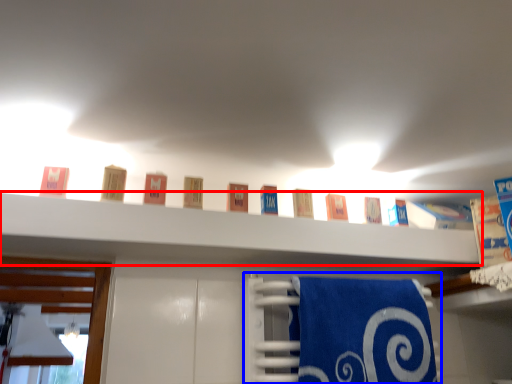
Question: Which point is closer to the camera, shelf (highlighted by a red box) or bath towel (highlighted by a blue box)?

Choices:
 (A) shelf
 (B) bath towel

Answer: (A)